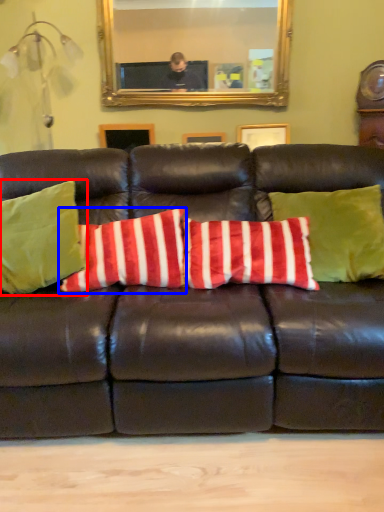
Question: Which object is closer to the camera taking this photo, pillow (highlighted by a red box) or pillow (highlighted by a blue box)?

Choices:
 (A) pillow
 (B) pillow

Answer: (A)